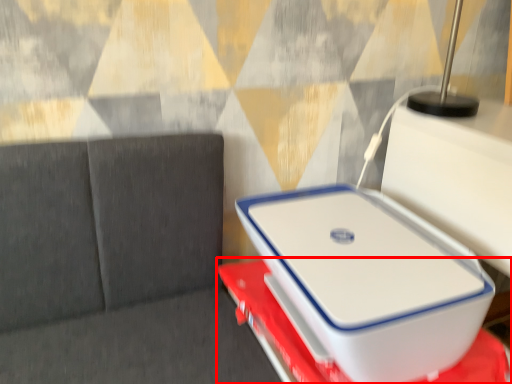
Question: From the image's perspective, where is furniture (annotated by the red box) located relative to laptop?

Choices:
 (A) below
 (B) above

Answer: (A)